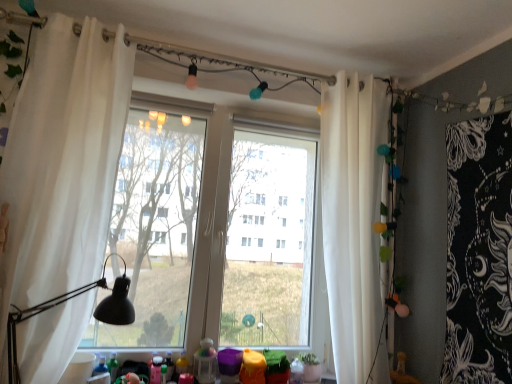
Question: Choose the correct answer: Is transparent glass window at center inside white sheer curtain at right, which ranks as the second curtain in front-to-back order, or outside it?

Choices:
 (A) outside
 (B) inside

Answer: (A)

Question: Is transparent glass window at center wider or thinner than white sheer curtain at right, which ranks as the second curtain in front-to-back order?

Choices:
 (A) wide
 (B) thin

Answer: (B)

Question: Which of these objects is positioned closest to the translucent plastic toy at lower center?

Choices:
 (A) white sheer curtain at left, which is counted as the second curtain, starting from the back
 (B) black matte table lamp at left
 (C) white sheer curtain at right, which ranks as the second curtain in front-to-back order
 (D) transparent glass window at center

Answer: (B)

Question: Which is nearer to the translucent plastic toy at lower center?

Choices:
 (A) black matte table lamp at left
 (B) transparent glass window at center
 (C) white sheer curtain at left, the first curtain positioned from the front
 (D) white sheer curtain at right, the first curtain positioned from the right

Answer: (A)